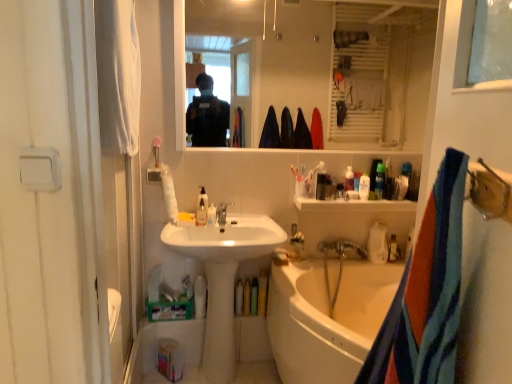
Question: From a real-world perspective, is translucent plastic bottle at upper center, which is the 3th toiletry in left-to-right order, over white fabric towel at left, the second towel/napkin viewed from the right?

Choices:
 (A) yes
 (B) no

Answer: (B)

Question: Does translucent plastic bottle at upper center, the 3th toiletry positioned from the right, have a lesser width compared to white fabric towel at left, which is counted as the 1th towel/napkin, starting from the top?

Choices:
 (A) no
 (B) yes

Answer: (B)

Question: From the image's perspective, would you say translucent plastic bottle at upper center, the 3th toiletry positioned from the right, is positioned over white fabric towel at left, arranged as the 2th towel/napkin when ordered from the bottom?

Choices:
 (A) no
 (B) yes

Answer: (A)

Question: Is translucent plastic bottle at upper center, the 3th toiletry positioned from the right, to the right of white fabric towel at left, which is counted as the 1th towel/napkin, starting from the top, from the viewer's perspective?

Choices:
 (A) yes
 (B) no

Answer: (A)

Question: Would you say translucent plastic bottle at upper center, the 3th toiletry positioned from the right, is a long distance from white fabric towel at left, arranged as the first towel/napkin when viewed from the back?

Choices:
 (A) no
 (B) yes

Answer: (B)

Question: Can you confirm if translucent plastic bottle at upper center, which is the 3th toiletry in left-to-right order, is wider than white fabric towel at left, arranged as the first towel/napkin when viewed from the back?

Choices:
 (A) yes
 (B) no

Answer: (B)

Question: From a real-world perspective, is white glossy sink at center below translucent plastic soap at lower right, which is the 3th bottle from left to right?

Choices:
 (A) no
 (B) yes

Answer: (B)

Question: Considering the relative positions of white glossy sink at center and translucent plastic soap at lower right, which is the 1th bottle in back-to-front order, in the image provided, is white glossy sink at center behind translucent plastic soap at lower right, which is the 1th bottle in back-to-front order,?

Choices:
 (A) no
 (B) yes

Answer: (A)

Question: Is white glossy sink at center completely or partially outside of translucent plastic soap at lower right, which is the 3th bottle from left to right?

Choices:
 (A) yes
 (B) no

Answer: (A)

Question: From a real-world perspective, is white glossy sink at center over translucent plastic soap at lower right, the 1th bottle viewed from the right?

Choices:
 (A) no
 (B) yes

Answer: (A)

Question: Considering the relative positions of white glossy sink at center and translucent plastic soap at lower right, the third bottle in the front-to-back sequence, in the image provided, is white glossy sink at center to the right of translucent plastic soap at lower right, the third bottle in the front-to-back sequence, from the viewer's perspective?

Choices:
 (A) yes
 (B) no

Answer: (B)

Question: From the image's perspective, is white glossy sink at center beneath translucent plastic soap at lower right, the 1th bottle viewed from the right?

Choices:
 (A) no
 (B) yes

Answer: (B)

Question: Is white plastic bottle at upper center, arranged as the 2th toiletry when viewed from the right, outside of white plastic shelf at upper center?

Choices:
 (A) yes
 (B) no

Answer: (A)